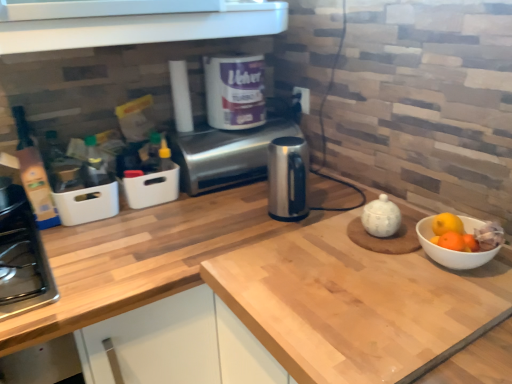
Question: Considering the relative sizes of light wood countertop at center and satin silver toaster at center in the image provided, is light wood countertop at center smaller than satin silver toaster at center?

Choices:
 (A) no
 (B) yes

Answer: (A)

Question: Is light wood countertop at center oriented towards satin silver toaster at center?

Choices:
 (A) no
 (B) yes

Answer: (A)

Question: Can we say light wood countertop at center lies outside satin silver toaster at center?

Choices:
 (A) yes
 (B) no

Answer: (A)

Question: Considering the relative sizes of light wood countertop at center and satin silver toaster at center in the image provided, is light wood countertop at center taller than satin silver toaster at center?

Choices:
 (A) yes
 (B) no

Answer: (A)

Question: Is light wood countertop at center at the left side of satin silver toaster at center?

Choices:
 (A) yes
 (B) no

Answer: (A)

Question: Choose the correct answer: Is satin silver toaster at center inside black plastic electric outlet at upper center or outside it?

Choices:
 (A) outside
 (B) inside

Answer: (A)

Question: Would you say satin silver toaster at center is to the left or to the right of black plastic electric outlet at upper center in the picture?

Choices:
 (A) right
 (B) left

Answer: (B)

Question: In the image, is satin silver toaster at center positioned in front of or behind black plastic electric outlet at upper center?

Choices:
 (A) behind
 (B) front

Answer: (B)

Question: Considering the positions of point (234, 137) and point (303, 104), is point (234, 137) closer or farther from the camera than point (303, 104)?

Choices:
 (A) farther
 (B) closer

Answer: (B)

Question: Considering the positions of point (303, 97) and point (394, 213), is point (303, 97) closer or farther from the camera than point (394, 213)?

Choices:
 (A) closer
 (B) farther

Answer: (B)

Question: Relative to white glossy tea pot at center-right, is black plastic electric outlet at upper center in front or behind?

Choices:
 (A) behind
 (B) front

Answer: (A)

Question: From their relative heights in the image, would you say black plastic electric outlet at upper center is taller or shorter than white glossy tea pot at center-right?

Choices:
 (A) short
 (B) tall

Answer: (A)

Question: Considering the positions of black plastic electric outlet at upper center and white glossy tea pot at center-right in the image, is black plastic electric outlet at upper center bigger or smaller than white glossy tea pot at center-right?

Choices:
 (A) big
 (B) small

Answer: (B)

Question: From a real-world perspective, is black plastic electric outlet at upper center physically located above or below satin silver toaster at center?

Choices:
 (A) below
 (B) above

Answer: (B)

Question: Considering the positions of black plastic electric outlet at upper center and satin silver toaster at center in the image, is black plastic electric outlet at upper center wider or thinner than satin silver toaster at center?

Choices:
 (A) wide
 (B) thin

Answer: (B)